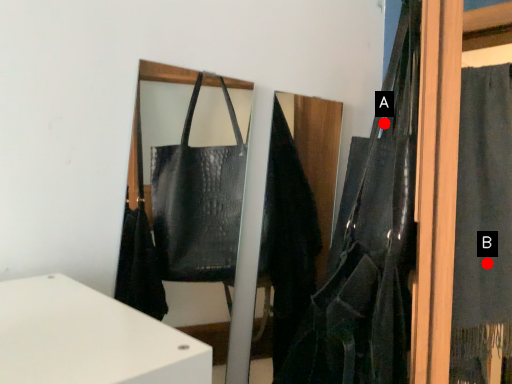
Question: Two points are circled on the image, labeled by A and B beside each circle. Which point is further to the camera?

Choices:
 (A) A is further
 (B) B is further

Answer: (B)